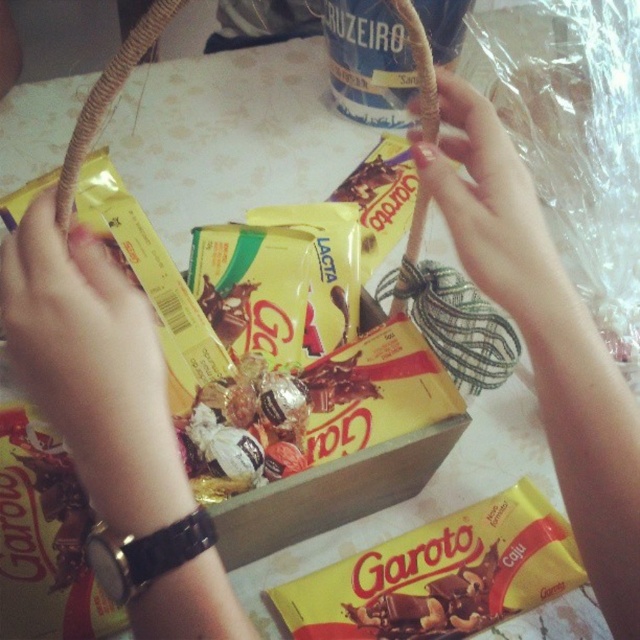
Does smooth skin hand at center have a smaller size compared to smooth beige rope at upper center?

Actually, smooth skin hand at center might be larger than smooth beige rope at upper center.

Does smooth skin hand at center have a lesser width compared to smooth beige rope at upper center?

No, smooth skin hand at center is not thinner than smooth beige rope at upper center.

Locate an element on the screen. The height and width of the screenshot is (640, 640). smooth skin hand at center is located at coordinates (545, 339).

Who is positioned more to the left, smooth skin hand at center or yellow matte chocolate bar at center?

Positioned to the left is yellow matte chocolate bar at center.

Which is behind, point (625, 589) or point (410, 540)?

Positioned behind is point (410, 540).

Is point (477, 256) positioned behind point (403, 612)?

No.

Image resolution: width=640 pixels, height=640 pixels. I want to click on smooth skin hand at center, so click(545, 339).

Measure the distance from yellow matte chocolate bar at center to smooth beige rope at upper center.

yellow matte chocolate bar at center and smooth beige rope at upper center are 11.38 inches apart from each other.

Where is `yellow matte chocolate bar at center`? yellow matte chocolate bar at center is located at coordinates (440, 576).

I want to click on yellow matte chocolate bar at center, so click(440, 576).